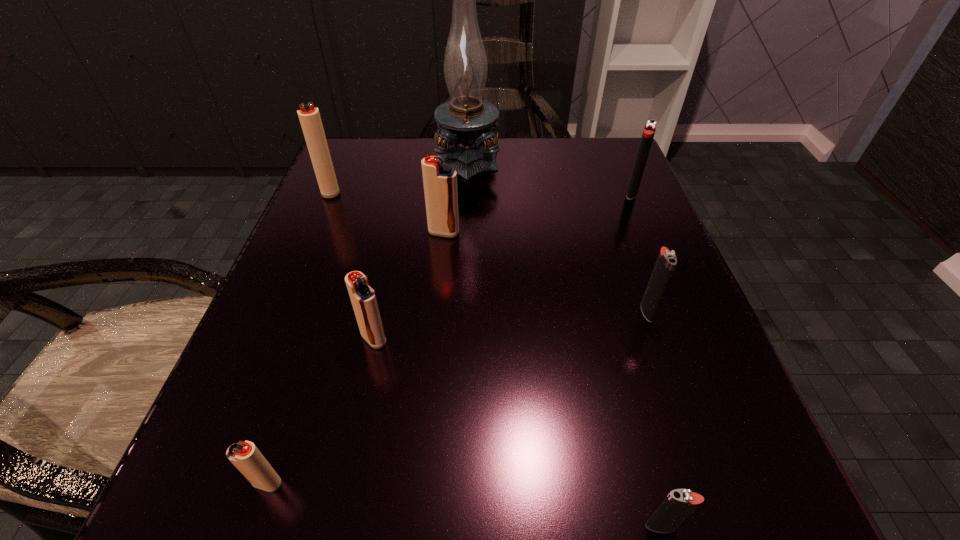
You are a GUI agent. You are given a task and a screenshot of the screen. Output one action in this format:
    pyautogui.click(x=<x>, y=<y>)
    Task: Click on the unoccupied position between the leftmost object and the second black igniter from left to right
    The width and height of the screenshot is (960, 540).
    Given the screenshot: What is the action you would take?
    pyautogui.click(x=489, y=251)

Locate an element on the screen. The image size is (960, 540). vacant space in between the farthest object and the rightmost black igniter is located at coordinates (550, 175).

Locate an element on the screen. Image resolution: width=960 pixels, height=540 pixels. vacant point located between the nearest object and the smallest red igniter is located at coordinates (464, 505).

Locate an element on the screen. The height and width of the screenshot is (540, 960). free point between the farthest red igniter and the third nearest object is located at coordinates (352, 265).

Where is `vacant space in between the nearest igniter and the seventh farthest object`? This screenshot has width=960, height=540. vacant space in between the nearest igniter and the seventh farthest object is located at coordinates (464, 505).

This screenshot has width=960, height=540. Identify the location of vacant area that lies between the tallest igniter and the rightmost object. (481, 192).

Identify which object is the second closest to the smallest red igniter. Please provide its 2D coordinates. Your answer should be formatted as a tuple, i.e. [(x, y)], where the tuple contains the x and y coordinates of a point satisfying the conditions above.

[(680, 503)]

Locate which object ranks fourth in proximity to the sixth farthest igniter. Please provide its 2D coordinates. Your answer should be formatted as a tuple, i.e. [(x, y)], where the tuple contains the x and y coordinates of a point satisfying the conditions above.

[(666, 261)]

This screenshot has width=960, height=540. I want to click on igniter that stands as the second closest to the nearest igniter, so click(363, 298).

Locate an element on the screen. The image size is (960, 540). igniter that stands as the closest to the leftmost red igniter is located at coordinates (440, 181).